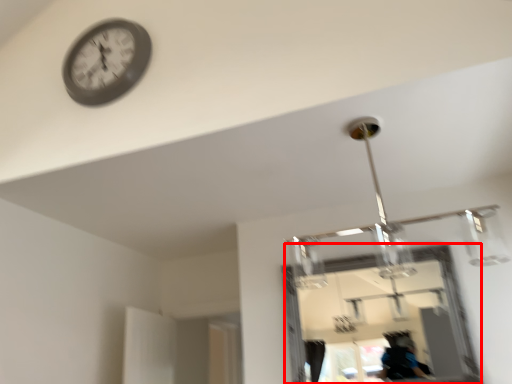
Question: Observing the image, what is the correct spatial positioning of mirror (annotated by the red box) in reference to wall clock?

Choices:
 (A) right
 (B) left

Answer: (A)